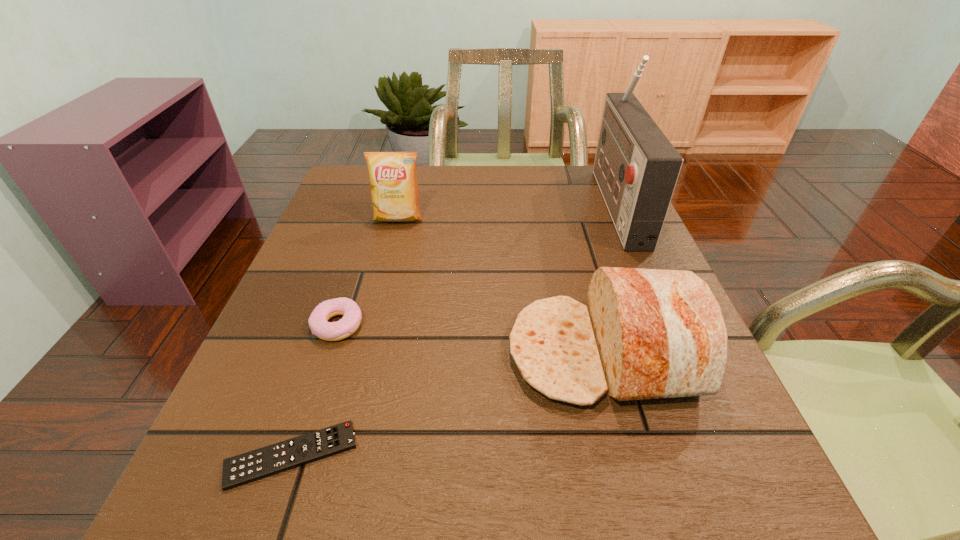
Locate an element on the screen. remote control that is at the left edge is located at coordinates (251, 466).

Find the location of `radio receiver at the right edge`. radio receiver at the right edge is located at coordinates (636, 167).

Image resolution: width=960 pixels, height=540 pixels. In order to click on bread situated at the right edge in this screenshot , I will do click(x=647, y=333).

You are a GUI agent. You are given a task and a screenshot of the screen. Output one action in this format:
    pyautogui.click(x=<x>, y=<y>)
    Task: Click on the object located in the far left corner section of the desktop
    The width and height of the screenshot is (960, 540).
    Given the screenshot: What is the action you would take?
    pyautogui.click(x=394, y=190)

Locate an element on the screen. The image size is (960, 540). object that is at the near left corner is located at coordinates (251, 466).

Identify the location of object that is positioned at the far right corner. This screenshot has width=960, height=540. (636, 167).

Image resolution: width=960 pixels, height=540 pixels. In order to click on free spot at the far edge of the desktop in this screenshot , I will do `click(530, 171)`.

Locate an element on the screen. free space at the near edge is located at coordinates (425, 519).

Locate an element on the screen. Image resolution: width=960 pixels, height=540 pixels. free space at the left edge of the desktop is located at coordinates (346, 295).

Identify the location of blank space at the right edge of the desktop. (670, 436).